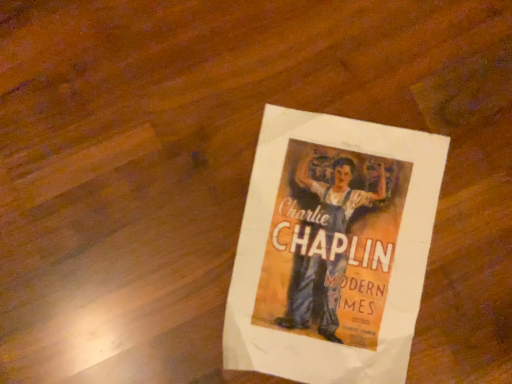
This screenshot has height=384, width=512. Identify the location of free location above matte paper poster at center (from a real-world perspective). (333, 251).